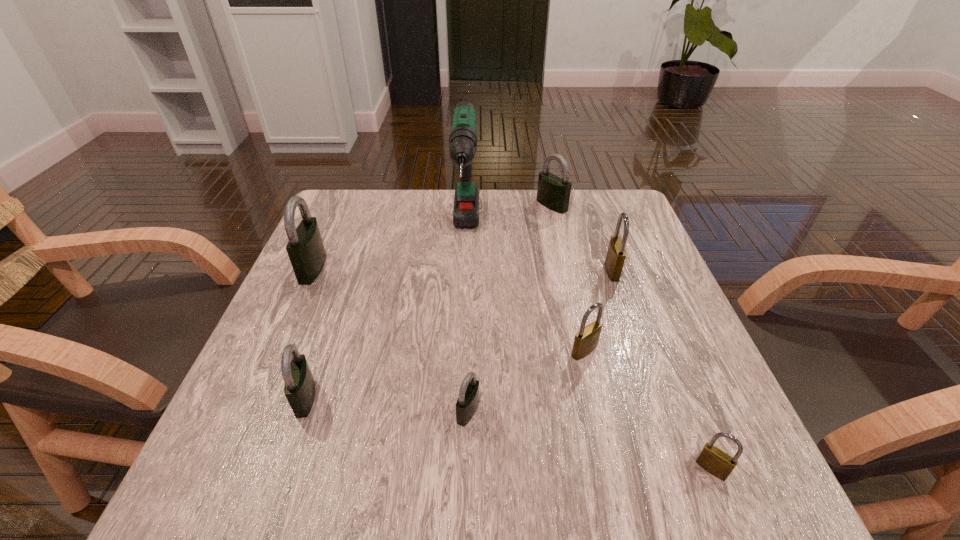
Where is `the second biggest brass padlock`? The image size is (960, 540). the second biggest brass padlock is located at coordinates (586, 340).

Where is `the fourth farthest padlock`? This screenshot has height=540, width=960. the fourth farthest padlock is located at coordinates (586, 340).

At what (x,y) coordinates should I click in order to perform the action: click on the third black padlock from left to right. Please return your answer as a coordinate pair (x, y). Looking at the image, I should click on (468, 399).

Find the location of a particular element. The height and width of the screenshot is (540, 960). the smallest black padlock is located at coordinates (468, 399).

Where is `the rightmost object`? The width and height of the screenshot is (960, 540). the rightmost object is located at coordinates (716, 462).

Image resolution: width=960 pixels, height=540 pixels. Find the location of `the nearest brass padlock`. the nearest brass padlock is located at coordinates (716, 462).

The width and height of the screenshot is (960, 540). I want to click on vacant space located 0.130m on the handle side of the green drill, so click(463, 319).

Locate an element on the screen. The image size is (960, 540). free spot located on the front of the leftmost black padlock is located at coordinates (234, 445).

Identify the location of free space located 0.400m on the front of the farthest black padlock. The width and height of the screenshot is (960, 540). (579, 325).

Find the location of `free spot located 0.160m on the back of the second object from right to left`. free spot located 0.160m on the back of the second object from right to left is located at coordinates (595, 222).